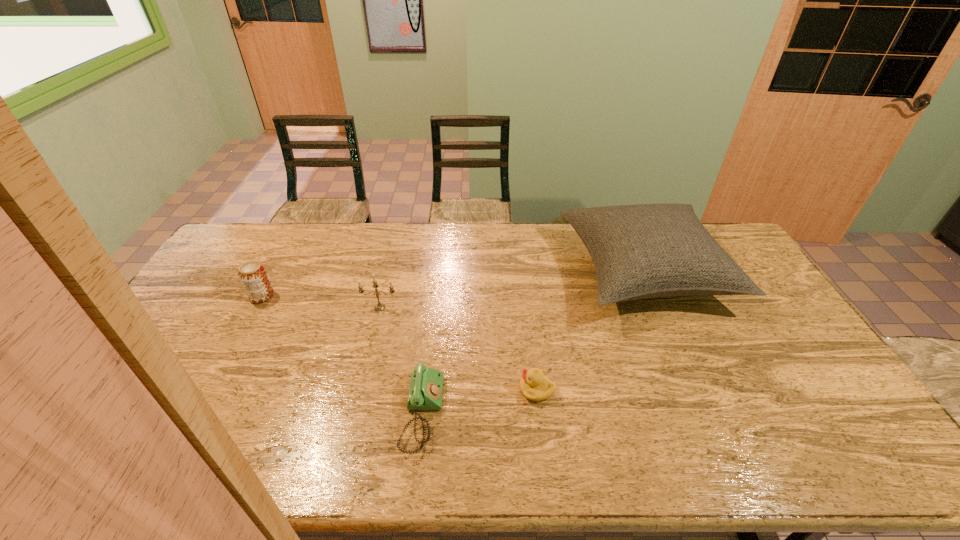
Identify the location of blank space at the right edge. The height and width of the screenshot is (540, 960). click(755, 307).

Where is `free space at the far left corner`? Image resolution: width=960 pixels, height=540 pixels. free space at the far left corner is located at coordinates (266, 235).

Locate an element on the screen. The image size is (960, 540). vacant space that's between the third object from right to left and the leftmost object is located at coordinates click(x=342, y=355).

Find the location of a particular element. The image size is (960, 540). free area in between the fourth object from right to left and the rightmost object is located at coordinates (512, 290).

Locate an element on the screen. free point between the telephone and the rightmost object is located at coordinates (533, 343).

The image size is (960, 540). Find the location of `vacant space that's between the tallest object and the duckling`. vacant space that's between the tallest object and the duckling is located at coordinates (590, 331).

Where is `free space that is in between the telephone and the rightmost object`? This screenshot has width=960, height=540. free space that is in between the telephone and the rightmost object is located at coordinates (533, 343).

Find the location of `free area in between the candle and the tallest object`. free area in between the candle and the tallest object is located at coordinates (512, 290).

Where is `free space between the fourth object from left to right and the beer can`? The width and height of the screenshot is (960, 540). free space between the fourth object from left to right and the beer can is located at coordinates (399, 343).

Image resolution: width=960 pixels, height=540 pixels. I want to click on vacant area that lies between the beer can and the tallest object, so click(x=453, y=284).